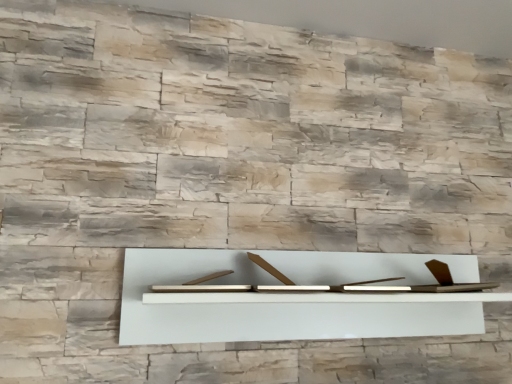
This screenshot has height=384, width=512. Describe the element at coordinates (274, 305) in the screenshot. I see `white matte shelf at center` at that location.

Locate an element on the screen. The image size is (512, 384). white matte shelf at center is located at coordinates (274, 305).

The width and height of the screenshot is (512, 384). Find the location of `white matte shelf at center`. white matte shelf at center is located at coordinates (274, 305).